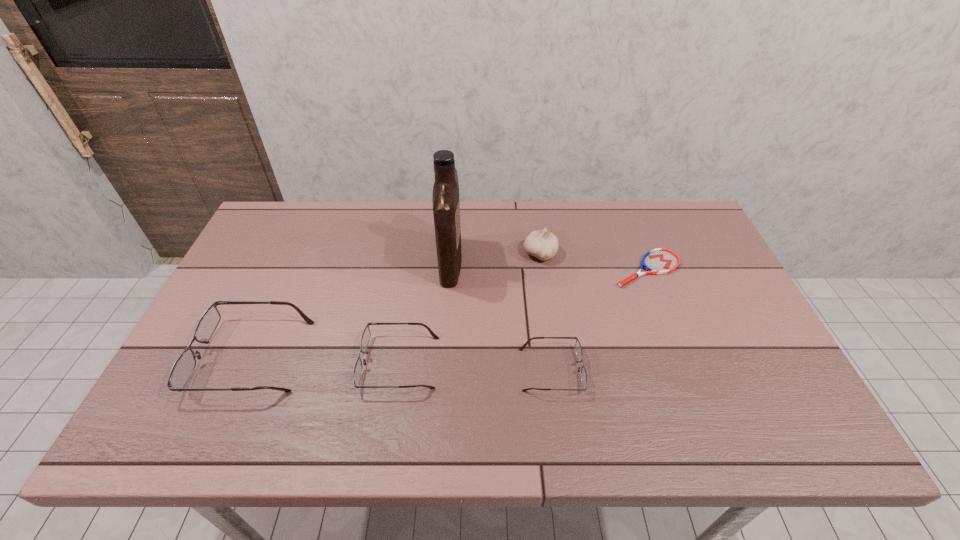
Identify which spectacles is the second closest to the tallest spectacles. Please provide its 2D coordinates. Your answer should be formatted as a tuple, i.e. [(x, y)], where the tuple contains the x and y coordinates of a point satisfying the conditions above.

[(578, 348)]

Locate an element on the screen. spectacles that is the closest to the leftmost object is located at coordinates (365, 338).

This screenshot has height=540, width=960. I want to click on vacant region that satisfies the following two spatial constraints: 1. on the front side of the garlic; 2. on the front-facing side of the second shortest object, so click(x=557, y=370).

This screenshot has width=960, height=540. I want to click on free location that satisfies the following two spatial constraints: 1. on the front side of the fifth shortest object; 2. on the front-facing side of the second shortest spectacles, so click(556, 363).

Find the location of `vacant space that satisfies the following two spatial constraints: 1. on the front side of the garlic; 2. on the right side of the shortest object`. vacant space that satisfies the following two spatial constraints: 1. on the front side of the garlic; 2. on the right side of the shortest object is located at coordinates (542, 269).

Identify the location of vacant space that satisfies the following two spatial constraints: 1. on the label side of the rightmost object; 2. on the right side of the tallest object. (450, 269).